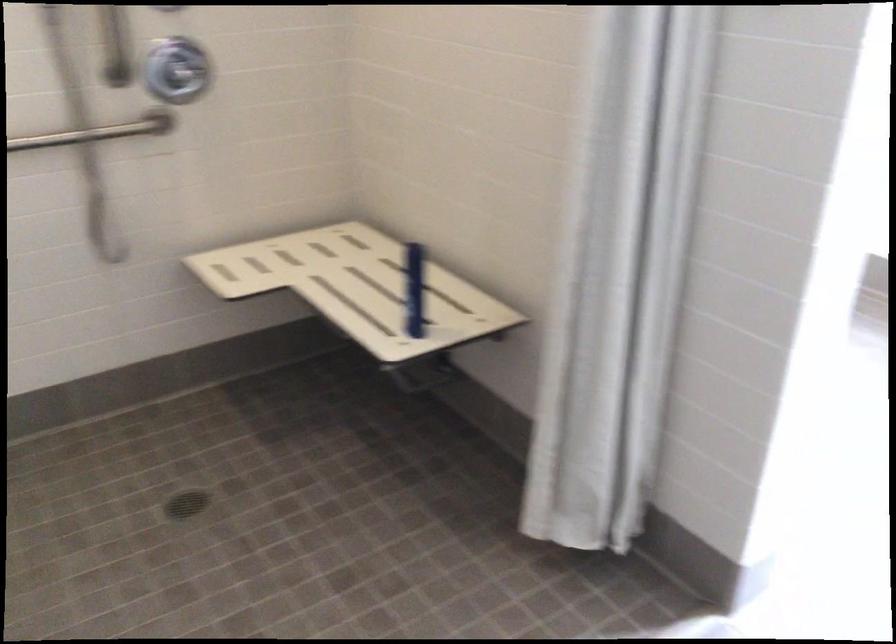
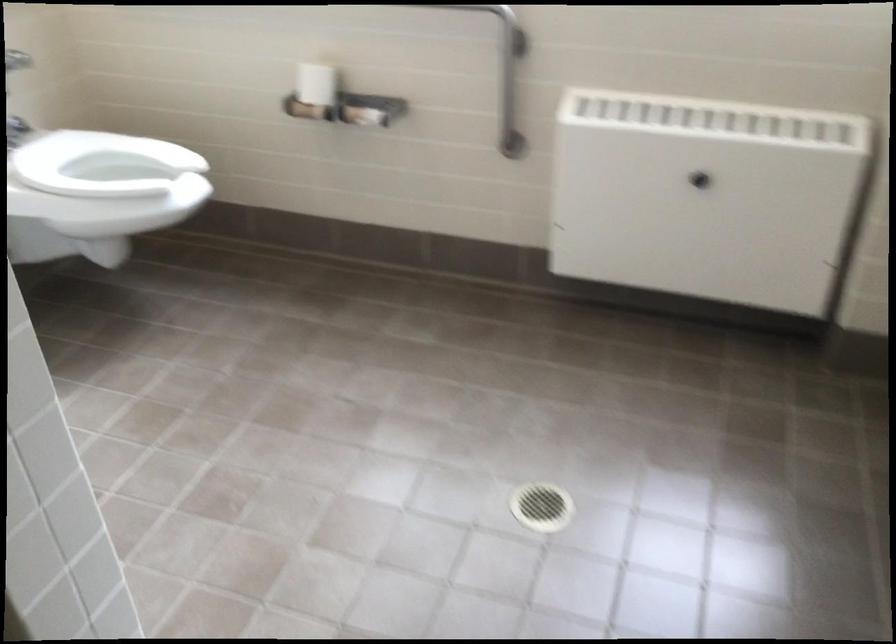
Question: Based on the continuous images, in which direction is the camera rotating? Reply with the corresponding letter.

Choices:
 (A) Left
 (B) Right
 (C) Up
 (D) Down

Answer: (B)